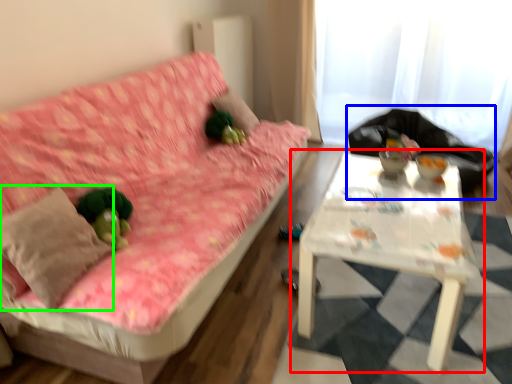
Question: Which is farther away from table (highlighted by a red box)? sit (highlighted by a blue box) or throw pillow (highlighted by a green box)?

Choices:
 (A) sit
 (B) throw pillow

Answer: (A)